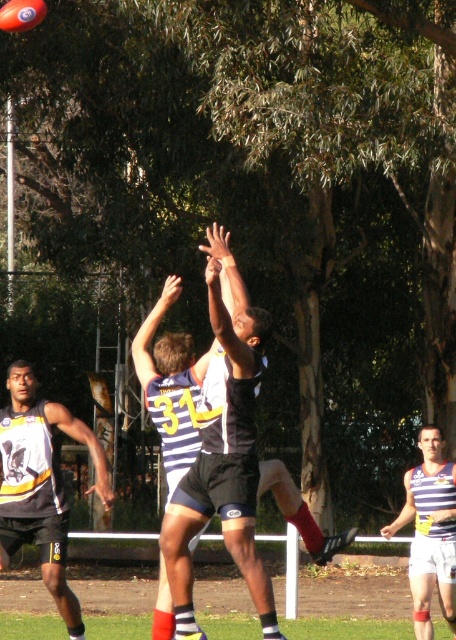
Consider the image. Measure the distance between yellow and black jersey at center and striped jersey at center.

They are 10.85 feet apart.

Is point (50, 500) behind point (408, 470)?

No.

In order to click on yellow and black jersey at center in this screenshot , I will do `click(41, 484)`.

Locate an element on the screen. The height and width of the screenshot is (640, 456). yellow and black jersey at center is located at coordinates (41, 484).

Between black jersey at center and striped jersey at center, which one has more height?

black jersey at center is taller.

Between point (234, 477) and point (446, 488), which one is positioned behind?

Positioned behind is point (446, 488).

Which is in front, point (253, 333) or point (434, 500)?

Point (253, 333) is in front.

Locate an element on the screen. Image resolution: width=456 pixels, height=640 pixels. black jersey at center is located at coordinates (224, 448).

Who is positioned more to the left, black jersey at center or yellow and black jersey at center?

yellow and black jersey at center is more to the left.

Between black jersey at center and yellow and black jersey at center, which one is positioned lower?

yellow and black jersey at center

Image resolution: width=456 pixels, height=640 pixels. I want to click on black jersey at center, so (x=224, y=448).

You are a GUI agent. You are given a task and a screenshot of the screen. Output one action in this format:
    pyautogui.click(x=<x>, y=<y>)
    Task: Click on the black jersey at center
    The width and height of the screenshot is (456, 640).
    Given the screenshot: What is the action you would take?
    pyautogui.click(x=224, y=448)